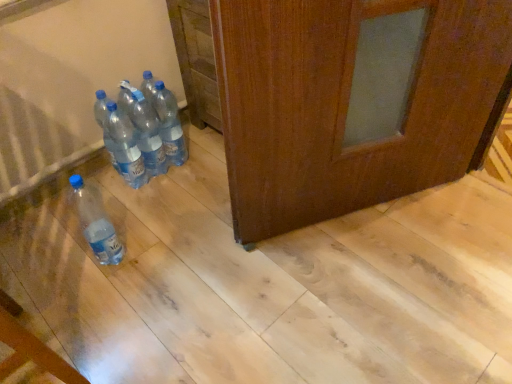
Question: From a real-world perspective, is clear plastic bottles at center, the second bottle from the left, positioned over transparent plastic bottles at center, arranged as the 2th bottle when viewed from the right, based on gravity?

Choices:
 (A) yes
 (B) no

Answer: (B)

Question: Does clear plastic bottles at center, the second bottle from the left, have a greater width compared to transparent plastic bottles at center, which ranks as the 3th bottle in left-to-right order?

Choices:
 (A) no
 (B) yes

Answer: (B)

Question: Can you confirm if clear plastic bottles at center, which is the 3th bottle in right-to-left order, is bigger than transparent plastic bottles at center, which ranks as the 3th bottle in left-to-right order?

Choices:
 (A) yes
 (B) no

Answer: (A)

Question: Are clear plastic bottles at center, which is the 3th bottle in right-to-left order, and transparent plastic bottles at center, arranged as the 2th bottle when viewed from the right, located far from each other?

Choices:
 (A) no
 (B) yes

Answer: (A)

Question: Is clear plastic bottles at center, which is the 3th bottle in right-to-left order, taller than transparent plastic bottles at center, arranged as the 2th bottle when viewed from the right?

Choices:
 (A) no
 (B) yes

Answer: (A)

Question: In terms of size, does transparent plastic bottles at center, arranged as the 2th bottle when viewed from the right, appear bigger or smaller than matte plastic bottle at lower left, marked as the 1th bottle in a left-to-right arrangement?

Choices:
 (A) small
 (B) big

Answer: (A)

Question: Considering the positions of transparent plastic bottles at center, which ranks as the 3th bottle in left-to-right order, and matte plastic bottle at lower left, which appears as the fourth bottle when viewed from the right, in the image, is transparent plastic bottles at center, which ranks as the 3th bottle in left-to-right order, wider or thinner than matte plastic bottle at lower left, which appears as the fourth bottle when viewed from the right,?

Choices:
 (A) thin
 (B) wide

Answer: (A)

Question: From their relative heights in the image, would you say transparent plastic bottles at center, which ranks as the 3th bottle in left-to-right order, is taller or shorter than matte plastic bottle at lower left, marked as the 1th bottle in a left-to-right arrangement?

Choices:
 (A) tall
 (B) short

Answer: (A)

Question: From the image's perspective, is transparent plastic bottles at center, which ranks as the 3th bottle in left-to-right order, above or below matte plastic bottle at lower left, which appears as the fourth bottle when viewed from the right?

Choices:
 (A) above
 (B) below

Answer: (A)

Question: Looking at the image, does clear plastic bottles at center, the second bottle from the left, seem bigger or smaller compared to transparent plastic bottles at center, arranged as the 2th bottle when viewed from the right?

Choices:
 (A) big
 (B) small

Answer: (A)

Question: Looking at their shapes, would you say clear plastic bottles at center, which is the 3th bottle in right-to-left order, is wider or thinner than transparent plastic bottles at center, which ranks as the 3th bottle in left-to-right order?

Choices:
 (A) thin
 (B) wide

Answer: (B)

Question: Considering the positions of clear plastic bottles at center, which is the 3th bottle in right-to-left order, and transparent plastic bottles at center, arranged as the 2th bottle when viewed from the right, in the image, is clear plastic bottles at center, which is the 3th bottle in right-to-left order, taller or shorter than transparent plastic bottles at center, arranged as the 2th bottle when viewed from the right,?

Choices:
 (A) short
 (B) tall

Answer: (A)

Question: Is clear plastic bottles at center, which is the 3th bottle in right-to-left order, spatially inside transparent plastic bottles at center, which ranks as the 3th bottle in left-to-right order, or outside of it?

Choices:
 (A) outside
 (B) inside

Answer: (A)

Question: In the image, is matte plastic bottle at lower left, which appears as the fourth bottle when viewed from the right, positioned in front of or behind clear plastic bottles at center, the second bottle from the left?

Choices:
 (A) behind
 (B) front

Answer: (B)

Question: Looking at their shapes, would you say matte plastic bottle at lower left, marked as the 1th bottle in a left-to-right arrangement, is wider or thinner than clear plastic bottles at center, the second bottle from the left?

Choices:
 (A) thin
 (B) wide

Answer: (B)